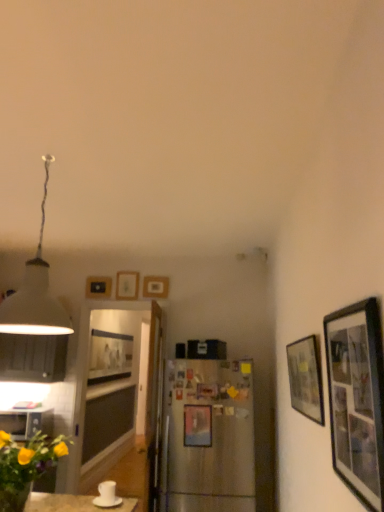
Question: Is metallic silver picture frame at center, which appears as the third picture frame when viewed from the front, at the right side of matte black picture frame at right, which appears as the 7th picture frame when viewed from the left?

Choices:
 (A) yes
 (B) no

Answer: (B)

Question: Is matte black picture frame at right, which appears as the 7th picture frame when viewed from the left, located within metallic silver picture frame at center, which is the 5th picture frame from left to right?

Choices:
 (A) yes
 (B) no

Answer: (B)

Question: Is metallic silver picture frame at center, which appears as the third picture frame when viewed from the front, touching matte black picture frame at right, which ranks as the 6th picture frame in back-to-front order?

Choices:
 (A) yes
 (B) no

Answer: (B)

Question: From a real-world perspective, does metallic silver picture frame at center, which appears as the third picture frame when viewed from the front, stand above matte black picture frame at right, which appears as the 7th picture frame when viewed from the left?

Choices:
 (A) yes
 (B) no

Answer: (B)

Question: From the image's perspective, is metallic silver picture frame at center, the third picture frame in the right-to-left sequence, located above matte black picture frame at right, which ranks as the 6th picture frame in back-to-front order?

Choices:
 (A) yes
 (B) no

Answer: (B)

Question: Is wooden picture frame at upper center, which is the 4th picture frame from front to back, bigger or smaller than matte wood picture frame at upper center, the fifth picture frame in the right-to-left sequence?

Choices:
 (A) big
 (B) small

Answer: (B)

Question: Looking at their shapes, would you say wooden picture frame at upper center, which ranks as the 4th picture frame in back-to-front order, is wider or thinner than matte wood picture frame at upper center, the third picture frame viewed from the back?

Choices:
 (A) wide
 (B) thin

Answer: (A)

Question: Is wooden picture frame at upper center, which ranks as the 4th picture frame in back-to-front order, in front of or behind matte wood picture frame at upper center, the third picture frame viewed from the back, in the image?

Choices:
 (A) behind
 (B) front

Answer: (B)

Question: Is point (150, 285) closer or farther from the camera than point (119, 290)?

Choices:
 (A) farther
 (B) closer

Answer: (B)

Question: Is white matte lampshade at upper left inside or outside of satin silver refrigerator at center?

Choices:
 (A) inside
 (B) outside

Answer: (B)

Question: Does point (41, 266) appear closer or farther from the camera than point (182, 459)?

Choices:
 (A) closer
 (B) farther

Answer: (A)

Question: From the image's perspective, is white matte lampshade at upper left above or below satin silver refrigerator at center?

Choices:
 (A) below
 (B) above

Answer: (B)

Question: Based on their sizes in the image, would you say white matte lampshade at upper left is bigger or smaller than satin silver refrigerator at center?

Choices:
 (A) small
 (B) big

Answer: (B)

Question: From the image's perspective, is matte black picture frame at right, the 1th picture frame in the right-to-left sequence, located above or below satin silver refrigerator at center?

Choices:
 (A) below
 (B) above

Answer: (B)

Question: Considering the relative positions of matte black picture frame at right, which ranks as the 6th picture frame in back-to-front order, and satin silver refrigerator at center in the image provided, is matte black picture frame at right, which ranks as the 6th picture frame in back-to-front order, to the left or to the right of satin silver refrigerator at center?

Choices:
 (A) left
 (B) right

Answer: (B)